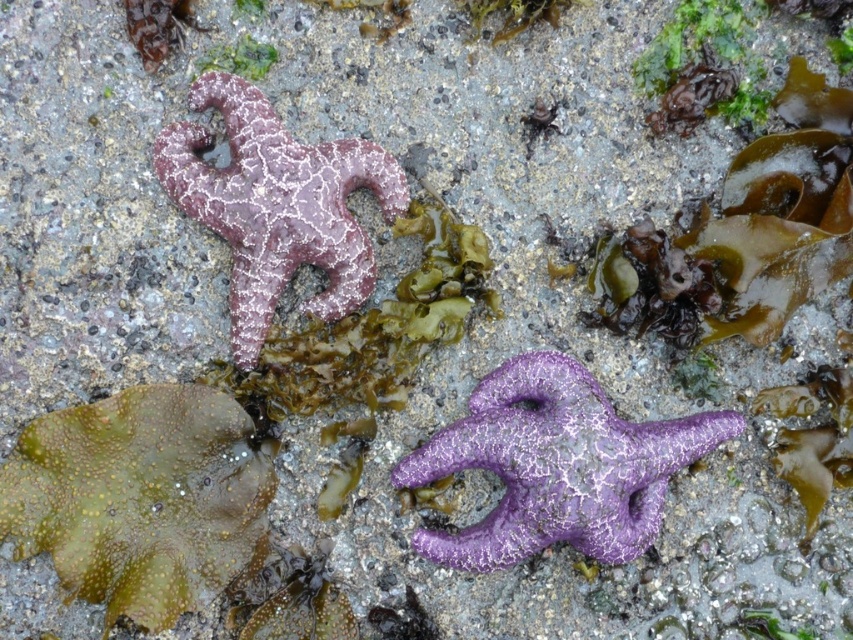
Question: Which point is closer to the camera taking this photo?

Choices:
 (A) (416, 541)
 (B) (235, 109)

Answer: (A)

Question: Estimate the real-world distances between objects in this image. Which object is closer to the purple matte starfish at center?

Choices:
 (A) purple matte starfish at upper left
 (B) green matte algae at upper center

Answer: (A)

Question: Can you confirm if purple matte starfish at center is bigger than green matte algae at upper center?

Choices:
 (A) no
 (B) yes

Answer: (B)

Question: Based on their relative distances, which object is nearer to the green matte algae at upper center?

Choices:
 (A) purple matte starfish at upper left
 (B) purple matte starfish at center

Answer: (A)

Question: Does purple matte starfish at center have a larger size compared to green matte algae at upper center?

Choices:
 (A) yes
 (B) no

Answer: (A)

Question: Does purple matte starfish at upper left have a larger size compared to green matte algae at upper center?

Choices:
 (A) no
 (B) yes

Answer: (B)